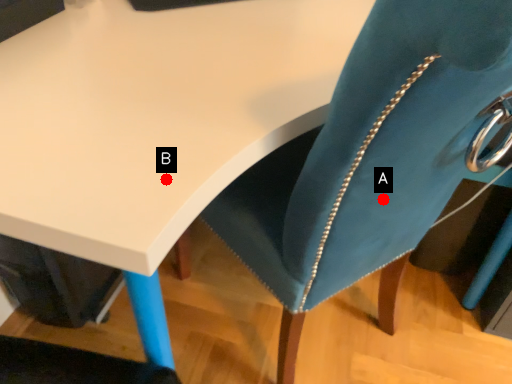
Question: Two points are circled on the image, labeled by A and B beside each circle. Which point is closer to the camera?

Choices:
 (A) A is closer
 (B) B is closer

Answer: (B)